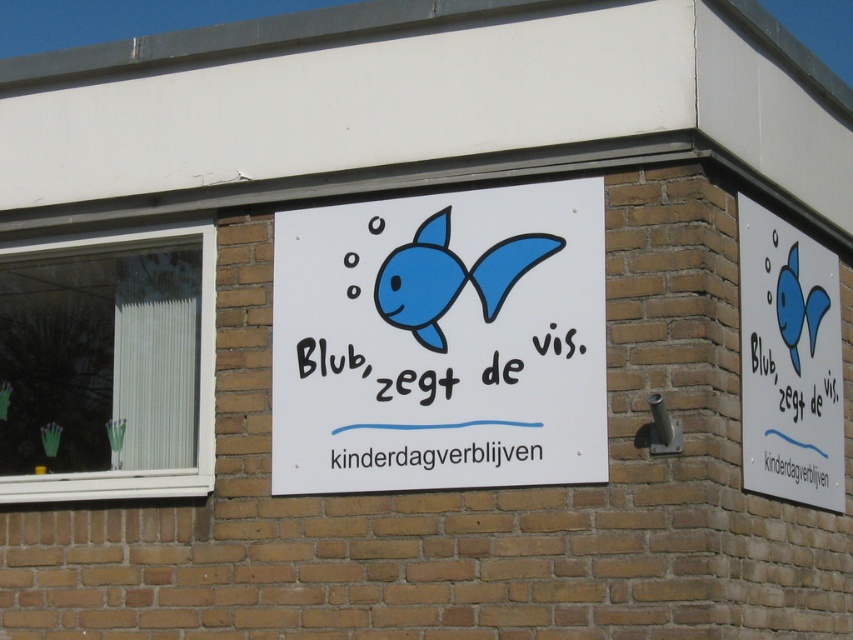
Question: Is white paper sign at center further to the viewer compared to blue matte fish at upper right?

Choices:
 (A) yes
 (B) no

Answer: (B)

Question: Among these points, which one is farthest from the camera?

Choices:
 (A) (515, 374)
 (B) (117, 248)

Answer: (B)

Question: Is white plastic window at lower left above matte blue fish at center?

Choices:
 (A) no
 (B) yes

Answer: (A)

Question: Which of the following is the farthest from the observer?

Choices:
 (A) white paper sign at center
 (B) matte blue fish at center
 (C) black painted text at center
 (D) white paper at center

Answer: (B)

Question: Does matte blue fish at center lie in front of black painted text at center?

Choices:
 (A) yes
 (B) no

Answer: (B)

Question: Which point is farther to the camera?

Choices:
 (A) white paper sign at center
 (B) black painted text at center
 (C) white plastic window at lower left
 (D) white paper at center

Answer: (C)